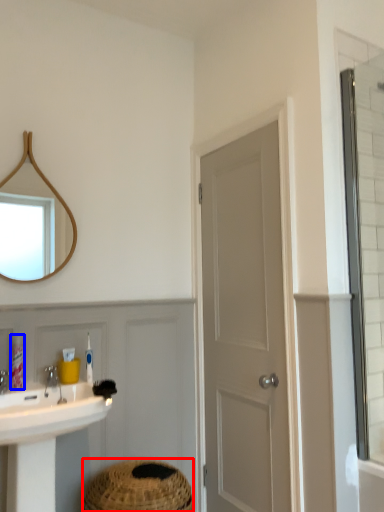
Question: Which object is further to the camera taking this photo, basket (highlighted by a red box) or toiletry (highlighted by a blue box)?

Choices:
 (A) basket
 (B) toiletry

Answer: (B)